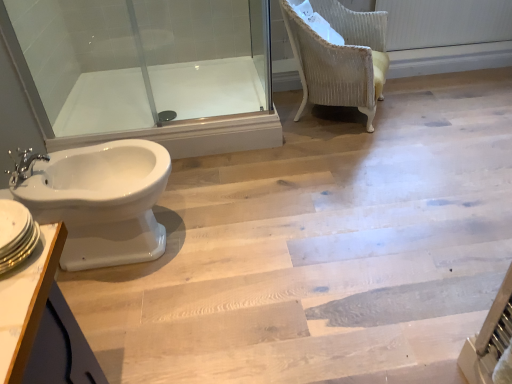
In order to click on spots to the right of white glossy bidet at lower left in this screenshot , I will do `click(234, 243)`.